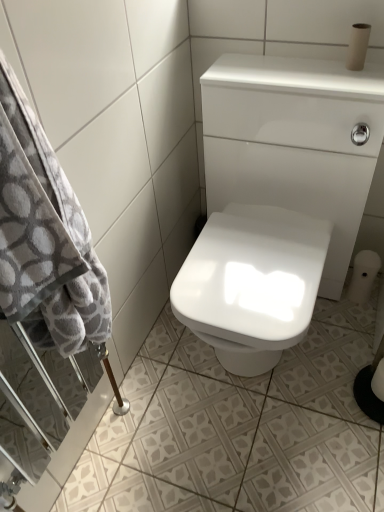
What do you see at coordinates (363, 275) in the screenshot? I see `white matte toilet paper at lower right, positioned as the 2th toilet paper in top-to-bottom order` at bounding box center [363, 275].

You are a GUI agent. You are given a task and a screenshot of the screen. Output one action in this format:
    pyautogui.click(x=<x>, y=<y>)
    Task: Click on the white glossy ceramic tile at lower center
    
    Given the screenshot: What is the action you would take?
    click(237, 426)

The image size is (384, 512). I want to click on gray soft towel at left, so click(x=45, y=241).

Find the location of a particular element. Image resolution: width=384 pixels, height=512 pixels. white glossy sink at center is located at coordinates (278, 190).

Where is `matte brown toilet paper at upper right, positioned as the 3th toilet paper in back-to-front order`? This screenshot has height=512, width=384. matte brown toilet paper at upper right, positioned as the 3th toilet paper in back-to-front order is located at coordinates (358, 46).

Is white matte toilet paper at lower right, arranged as the 2th toilet paper when viewed from the front, facing towards white glossy ceramic tile at lower center?

No.

In terms of height, does white matte toilet paper at lower right, positioned as the first toilet paper in bottom-to-top order, look taller or shorter compared to white glossy ceramic tile at lower center?

In the image, white matte toilet paper at lower right, positioned as the first toilet paper in bottom-to-top order, appears to be taller than white glossy ceramic tile at lower center.

From the image's perspective, is white matte toilet paper at lower right, the 2th toilet paper from the back, above white glossy ceramic tile at lower center?

Yes, from the image's perspective, white matte toilet paper at lower right, the 2th toilet paper from the back, is on top of white glossy ceramic tile at lower center.

Identify the location of the 1st toilet paper above the white glossy ceramic tile at lower center (from the image's perspective). Image resolution: width=384 pixels, height=512 pixels. (378, 381).

Consider the image. Relative to white matte toilet paper at lower right, which is counted as the 1th toilet paper, starting from the back, is white matte toilet paper at lower right, the 2th toilet paper from the back, in front or behind?

white matte toilet paper at lower right, the 2th toilet paper from the back, is in front of white matte toilet paper at lower right, which is counted as the 1th toilet paper, starting from the back.

From the image's perspective, between white matte toilet paper at lower right, which is counted as the 3th toilet paper, starting from the top, and white matte toilet paper at lower right, which is counted as the 1th toilet paper, starting from the back, who is located below?

From the image's view, white matte toilet paper at lower right, which is counted as the 3th toilet paper, starting from the top, is below.

In the image, there is a white matte toilet paper at lower right, which is the third toilet paper in front-to-back order. Where is `toilet paper below it (from a real-world perspective)`? Image resolution: width=384 pixels, height=512 pixels. toilet paper below it (from a real-world perspective) is located at coordinates (378, 381).

From the image's perspective, would you say gray soft towel at left is positioned over matte brown toilet paper at upper right, the 3th toilet paper in the bottom-to-top sequence?

No, from the image's perspective, gray soft towel at left is not on top of matte brown toilet paper at upper right, the 3th toilet paper in the bottom-to-top sequence.

Is gray soft towel at left in contact with matte brown toilet paper at upper right, the 3th toilet paper in the bottom-to-top sequence?

gray soft towel at left and matte brown toilet paper at upper right, the 3th toilet paper in the bottom-to-top sequence, are not in contact.

Based on the photo, considering the relative sizes of gray soft towel at left and matte brown toilet paper at upper right, the 3th toilet paper in the bottom-to-top sequence, in the image provided, is gray soft towel at left taller than matte brown toilet paper at upper right, the 3th toilet paper in the bottom-to-top sequence,?

Yes.

In the scene shown: From a real-world perspective, which is physically above, gray soft towel at left or white matte toilet paper at lower right, the 2th toilet paper from the back?

gray soft towel at left.

Which object is wider, gray soft towel at left or white matte toilet paper at lower right, the 2th toilet paper from the back?

Wider between the two is gray soft towel at left.

Which object is more forward, gray soft towel at left or white matte toilet paper at lower right, the 2th toilet paper from the back?

gray soft towel at left is closer to the camera.

In the scene shown: Is gray soft towel at left next to white matte toilet paper at lower right, which is counted as the 3th toilet paper, starting from the top?

No, gray soft towel at left is not in contact with white matte toilet paper at lower right, which is counted as the 3th toilet paper, starting from the top.

From the image's perspective, is white glossy ceramic tile at lower center beneath white matte toilet paper at lower right, which is counted as the 1th toilet paper, starting from the back?

Correct, white glossy ceramic tile at lower center appears lower than white matte toilet paper at lower right, which is counted as the 1th toilet paper, starting from the back, in the image.

Does white glossy ceramic tile at lower center lie behind white matte toilet paper at lower right, which is the third toilet paper in front-to-back order?

No, it is not.

How different are the orientations of white glossy ceramic tile at lower center and white matte toilet paper at lower right, positioned as the 2th toilet paper in top-to-bottom order, in degrees?

The angle between the facing direction of white glossy ceramic tile at lower center and the facing direction of white matte toilet paper at lower right, positioned as the 2th toilet paper in top-to-bottom order, is 2.09 degrees.

Does white glossy ceramic tile at lower center turn towards white matte toilet paper at lower right, the 2th toilet paper ordered from the bottom?

No, white glossy ceramic tile at lower center is not aimed at white matte toilet paper at lower right, the 2th toilet paper ordered from the bottom.

Is gray soft towel at left situated inside white matte toilet paper at lower right, the 2th toilet paper ordered from the bottom, or outside?

gray soft towel at left is not enclosed by white matte toilet paper at lower right, the 2th toilet paper ordered from the bottom.

Considering the relative positions of gray soft towel at left and white matte toilet paper at lower right, the 2th toilet paper ordered from the bottom, in the image provided, is gray soft towel at left in front of white matte toilet paper at lower right, the 2th toilet paper ordered from the bottom,?

Yes, gray soft towel at left is closer to the camera.

Considering the sizes of gray soft towel at left and white matte toilet paper at lower right, the 2th toilet paper ordered from the bottom, in the image, is gray soft towel at left wider or thinner than white matte toilet paper at lower right, the 2th toilet paper ordered from the bottom,?

In the image, gray soft towel at left appears to be wider than white matte toilet paper at lower right, the 2th toilet paper ordered from the bottom.

Considering the positions of point (42, 197) and point (373, 273), is point (42, 197) closer or farther from the camera than point (373, 273)?

Point (42, 197).

Is white matte toilet paper at lower right, the 2th toilet paper ordered from the bottom, at the back of matte brown toilet paper at upper right, positioned as the 1th toilet paper in top-to-bottom order?

No.

Is matte brown toilet paper at upper right, the 1th toilet paper positioned from the front, next to white matte toilet paper at lower right, which is the third toilet paper in front-to-back order?

No.

From a real-world perspective, is matte brown toilet paper at upper right, positioned as the 1th toilet paper in top-to-bottom order, above or below white matte toilet paper at lower right, which is counted as the 1th toilet paper, starting from the back?

From a real-world perspective, matte brown toilet paper at upper right, positioned as the 1th toilet paper in top-to-bottom order, is physically above white matte toilet paper at lower right, which is counted as the 1th toilet paper, starting from the back.

Does matte brown toilet paper at upper right, positioned as the 1th toilet paper in top-to-bottom order, come in front of white matte toilet paper at lower right, positioned as the 2th toilet paper in top-to-bottom order?

Yes, matte brown toilet paper at upper right, positioned as the 1th toilet paper in top-to-bottom order, is closer to the camera.

The height and width of the screenshot is (512, 384). Identify the location of ceramic tile below the white matte toilet paper at lower right, which is counted as the 3th toilet paper, starting from the top (from the image's perspective). (237, 426).

Identify the location of toilet paper on the right of white matte toilet paper at lower right, which is counted as the 3th toilet paper, starting from the top. The width and height of the screenshot is (384, 512). (363, 275).

From the image, which object appears to be farther from white glossy ceramic tile at lower center, matte brown toilet paper at upper right, positioned as the 1th toilet paper in top-to-bottom order, or white matte toilet paper at lower right, which is the third toilet paper in front-to-back order?

matte brown toilet paper at upper right, positioned as the 1th toilet paper in top-to-bottom order, is further to white glossy ceramic tile at lower center.

From the image, which object appears to be nearer to white glossy sink at center, matte brown toilet paper at upper right, the 3th toilet paper in the bottom-to-top sequence, or white matte toilet paper at lower right, positioned as the first toilet paper in bottom-to-top order?

matte brown toilet paper at upper right, the 3th toilet paper in the bottom-to-top sequence.

Estimate the real-world distances between objects in this image. Which object is further from white glossy ceramic tile at lower center, white matte toilet paper at lower right, which is counted as the 1th toilet paper, starting from the back, or gray soft towel at left?

The object further to white glossy ceramic tile at lower center is gray soft towel at left.

Considering their positions, is gray soft towel at left positioned closer to white glossy ceramic tile at lower center than white matte toilet paper at lower right, which is counted as the 3th toilet paper, starting from the top?

Among the two, white matte toilet paper at lower right, which is counted as the 3th toilet paper, starting from the top, is located nearer to white glossy ceramic tile at lower center.

From the image, which object appears to be farther from white glossy ceramic tile at lower center, white glossy sink at center or matte brown toilet paper at upper right, positioned as the 3th toilet paper in back-to-front order?

Based on the image, matte brown toilet paper at upper right, positioned as the 3th toilet paper in back-to-front order, appears to be further to white glossy ceramic tile at lower center.

When comparing their distances from white matte toilet paper at lower right, which is the third toilet paper in front-to-back order, does white glossy sink at center or white matte toilet paper at lower right, positioned as the first toilet paper in bottom-to-top order, seem further?

Based on the image, white glossy sink at center appears to be further to white matte toilet paper at lower right, which is the third toilet paper in front-to-back order.

When comparing their distances from white glossy sink at center, does white matte toilet paper at lower right, arranged as the 2th toilet paper when viewed from the front, or white matte toilet paper at lower right, which is the third toilet paper in front-to-back order, seem further?

white matte toilet paper at lower right, arranged as the 2th toilet paper when viewed from the front, is further to white glossy sink at center.

Estimate the real-world distances between objects in this image. Which object is closer to gray soft towel at left, white matte toilet paper at lower right, positioned as the first toilet paper in bottom-to-top order, or matte brown toilet paper at upper right, the 1th toilet paper positioned from the front?

matte brown toilet paper at upper right, the 1th toilet paper positioned from the front.

Where is `sink between matte brown toilet paper at upper right, the 1th toilet paper positioned from the front, and white glossy ceramic tile at lower center, in the vertical direction`? sink between matte brown toilet paper at upper right, the 1th toilet paper positioned from the front, and white glossy ceramic tile at lower center, in the vertical direction is located at coordinates (278, 190).

Where is `ceramic tile between white glossy sink at center and white matte toilet paper at lower right, positioned as the 2th toilet paper in top-to-bottom order, along the z-axis`? This screenshot has width=384, height=512. ceramic tile between white glossy sink at center and white matte toilet paper at lower right, positioned as the 2th toilet paper in top-to-bottom order, along the z-axis is located at coordinates (237, 426).

Identify the location of sink between gray soft towel at left and white matte toilet paper at lower right, the 2th toilet paper ordered from the bottom, from front to back. (278, 190).

Locate an element on the screen. This screenshot has width=384, height=512. ceramic tile between gray soft towel at left and white matte toilet paper at lower right, which is counted as the 3th toilet paper, starting from the top, from left to right is located at coordinates (237, 426).